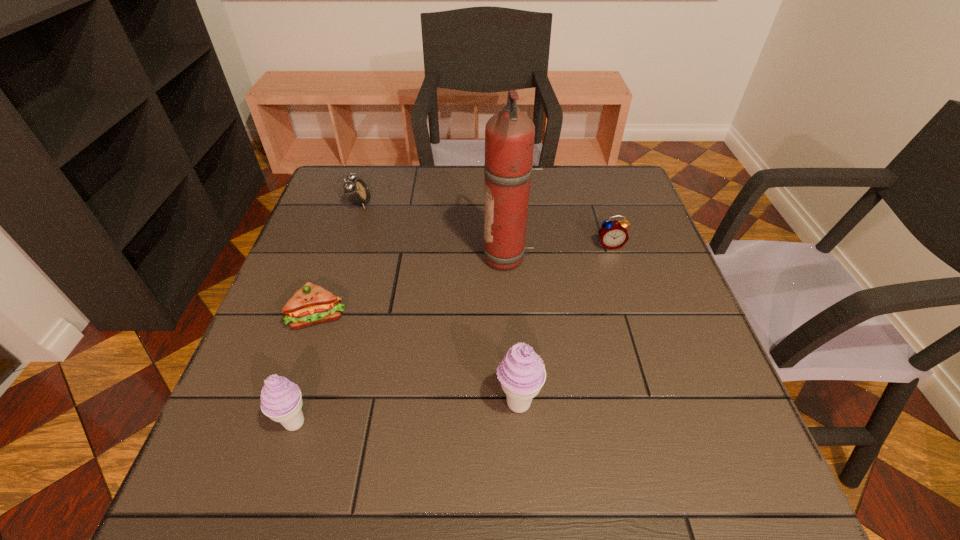
Where is `the left icecream`? the left icecream is located at coordinates (281, 400).

I want to click on the third tallest object, so click(281, 400).

You are a GUI agent. You are given a task and a screenshot of the screen. Output one action in this format:
    pyautogui.click(x=<x>, y=<y>)
    Task: Click on the taller icecream
    
    Given the screenshot: What is the action you would take?
    pyautogui.click(x=521, y=372)

Image resolution: width=960 pixels, height=540 pixels. I want to click on the fifth shortest object, so [521, 372].

The image size is (960, 540). I want to click on the left alarm clock, so click(357, 192).

Find the location of a particular element. Image resolution: width=960 pixels, height=540 pixels. the farthest object is located at coordinates (357, 192).

This screenshot has height=540, width=960. Identify the location of the rightmost object. (613, 234).

Locate an element on the screen. This screenshot has height=540, width=960. the nearer alarm clock is located at coordinates (613, 234).

Where is `fire extinguisher`? Image resolution: width=960 pixels, height=540 pixels. fire extinguisher is located at coordinates (509, 134).

Image resolution: width=960 pixels, height=540 pixels. Find the location of `the fourth farthest object`. the fourth farthest object is located at coordinates (312, 304).